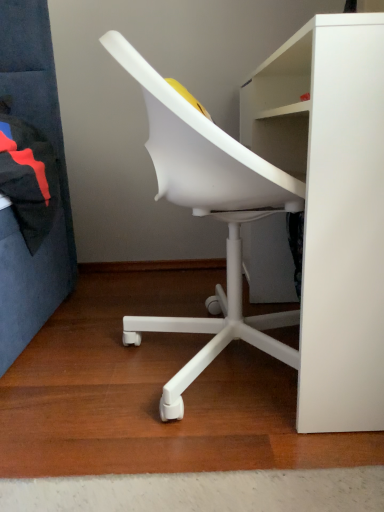
Question: From the image's perspective, is white matte desk at center under white plastic chair at center?

Choices:
 (A) no
 (B) yes

Answer: (A)

Question: Is white matte desk at center outside white plastic chair at center?

Choices:
 (A) no
 (B) yes

Answer: (B)

Question: Does white matte desk at center have a greater height compared to white plastic chair at center?

Choices:
 (A) no
 (B) yes

Answer: (A)

Question: From a real-world perspective, does white matte desk at center stand above white plastic chair at center?

Choices:
 (A) yes
 (B) no

Answer: (B)

Question: Is white matte desk at center smaller than white plastic chair at center?

Choices:
 (A) yes
 (B) no

Answer: (B)

Question: Considering the relative sizes of white matte desk at center and white plastic chair at center in the image provided, is white matte desk at center bigger than white plastic chair at center?

Choices:
 (A) no
 (B) yes

Answer: (B)

Question: Does white plastic chair at center lie in front of white matte desk at center?

Choices:
 (A) yes
 (B) no

Answer: (B)

Question: From the image's perspective, is white plastic chair at center located above white matte desk at center?

Choices:
 (A) yes
 (B) no

Answer: (B)

Question: Does white plastic chair at center have a larger size compared to white matte desk at center?

Choices:
 (A) no
 (B) yes

Answer: (A)

Question: Is white plastic chair at center far from white matte desk at center?

Choices:
 (A) yes
 (B) no

Answer: (B)

Question: Are white plastic chair at center and white matte desk at center beside each other?

Choices:
 (A) no
 (B) yes

Answer: (A)

Question: From a real-world perspective, does white plastic chair at center sit lower than white matte desk at center?

Choices:
 (A) no
 (B) yes

Answer: (A)

Question: From the image's perspective, is white plastic chair at center located above or below white matte desk at center?

Choices:
 (A) below
 (B) above

Answer: (A)